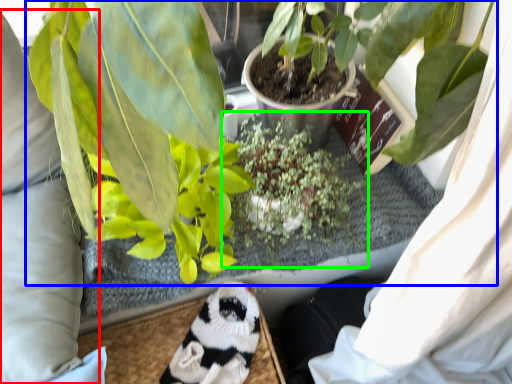
Question: Which object is positioned closest to clothing (highlighted by a red box)? Select from houseplant (highlighted by a blue box) and houseplant (highlighted by a green box).

Choices:
 (A) houseplant
 (B) houseplant

Answer: (B)